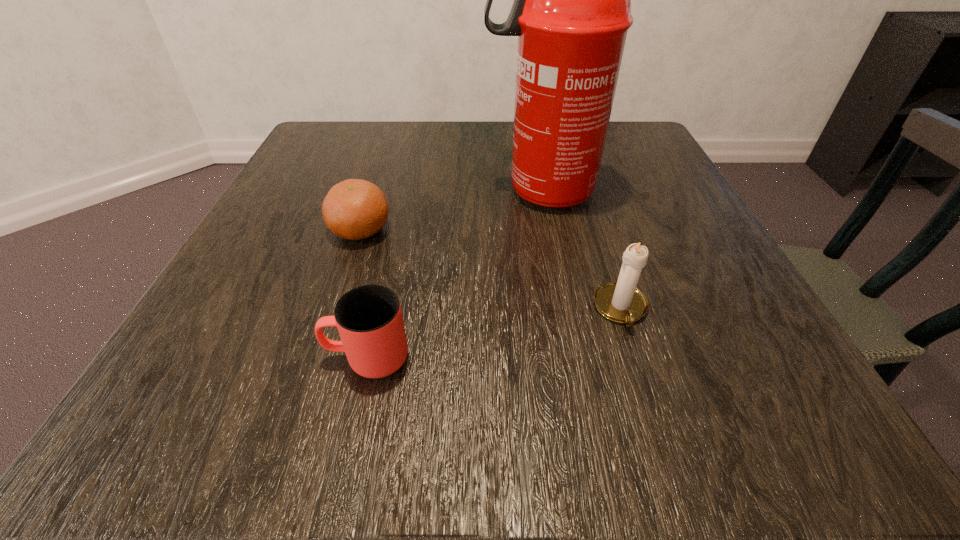
This screenshot has width=960, height=540. Find the location of `object that is at the far edge`. object that is at the far edge is located at coordinates (571, 12).

Identify the location of object at the near edge. This screenshot has height=540, width=960. click(x=369, y=319).

You are a GUI agent. You are given a task and a screenshot of the screen. Output one action in this format:
    pyautogui.click(x=<x>, y=<y>)
    Task: Click on the object that is at the left edge
    The image size is (960, 540).
    Given the screenshot: What is the action you would take?
    pyautogui.click(x=354, y=209)

The image size is (960, 540). In order to click on fire extinguisher situated at the right edge in this screenshot , I will do `click(571, 12)`.

Where is `candle holder situated at the right edge`? candle holder situated at the right edge is located at coordinates (621, 301).

The width and height of the screenshot is (960, 540). I want to click on object positioned at the far right corner, so click(571, 12).

This screenshot has width=960, height=540. In the image, there is a desktop. In order to click on vacant space at the far edge in this screenshot , I will do `click(431, 170)`.

In the image, there is a desktop. Identify the location of vacant space at the near edge. (373, 414).

Identify the location of vacant area at the left edge. This screenshot has height=540, width=960. coord(369,179).

Locate an element on the screen. This screenshot has height=540, width=960. vacant space at the right edge of the desktop is located at coordinates (604, 204).